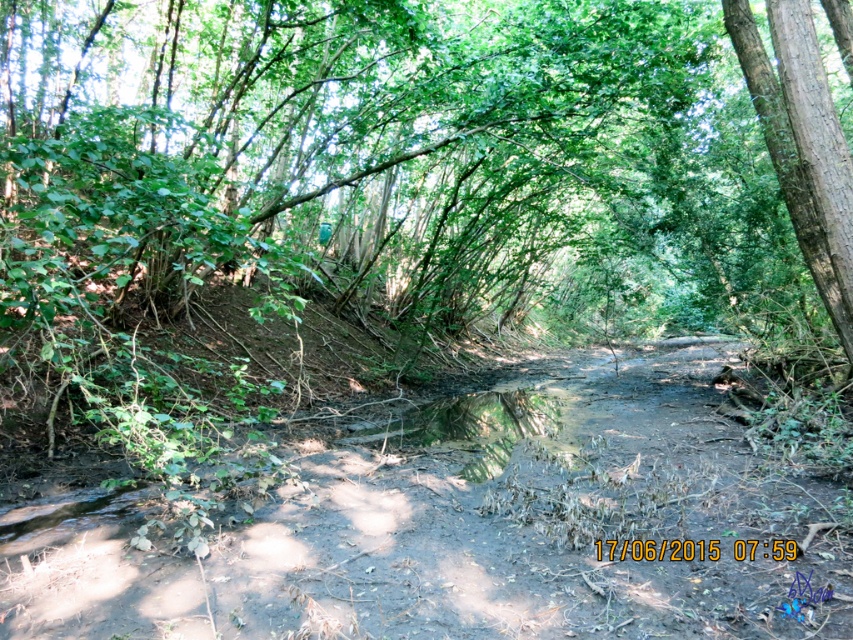
Who is lower down, brown dirt track at center or smooth brown tree trunk at right?

brown dirt track at center is lower down.

Is point (312, 556) farther from camera compared to point (827, 248)?

No.

Between point (621, 403) and point (770, 67), which one is positioned behind?

The point (621, 403) is behind.

Where is `brown dirt track at center`? brown dirt track at center is located at coordinates (480, 525).